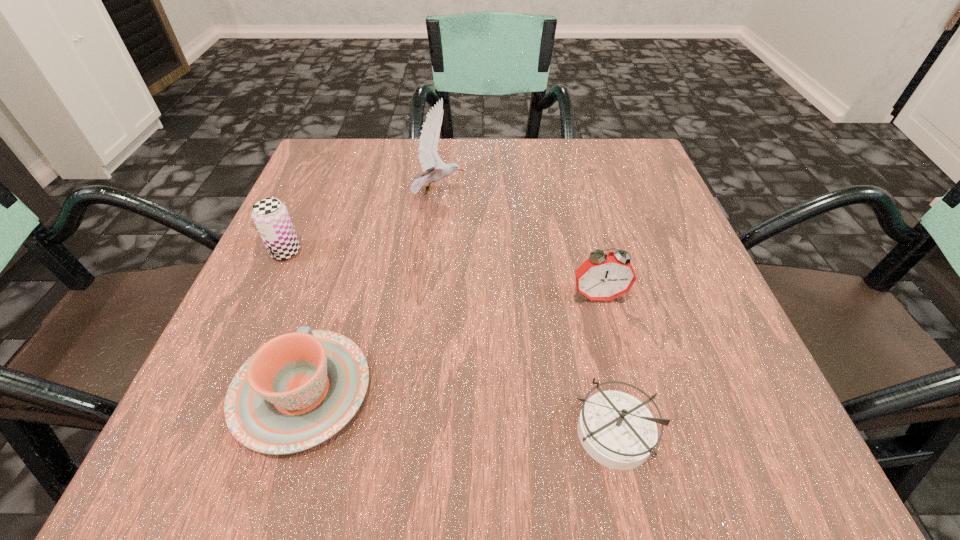
Identify the location of free space located on the handle side of the chinaware. pyautogui.click(x=359, y=207).

Where is `vacant area situated 0.230m on the handle side of the chinaware`? The image size is (960, 540). vacant area situated 0.230m on the handle side of the chinaware is located at coordinates (350, 237).

Image resolution: width=960 pixels, height=540 pixels. In order to click on free space located 0.340m on the left of the compass in this screenshot , I will do `click(304, 433)`.

Where is `object at the far edge`? object at the far edge is located at coordinates (434, 169).

Find the location of a particular element. The width and height of the screenshot is (960, 540). chinaware positioned at the near edge is located at coordinates (299, 389).

This screenshot has width=960, height=540. Identify the location of compass that is at the near edge. (617, 430).

At what (x,y) coordinates should I click in order to perform the action: click on beer can at the left edge. Please return your answer as a coordinate pair (x, y). This screenshot has width=960, height=540. Looking at the image, I should click on (271, 217).

This screenshot has width=960, height=540. Find the location of `chinaware located in the left edge section of the desktop`. chinaware located in the left edge section of the desktop is located at coordinates (299, 389).

Where is `object at the right edge`? This screenshot has height=540, width=960. object at the right edge is located at coordinates (602, 277).

Find the location of a particular element. This screenshot has height=540, width=960. object that is at the near left corner is located at coordinates (299, 389).